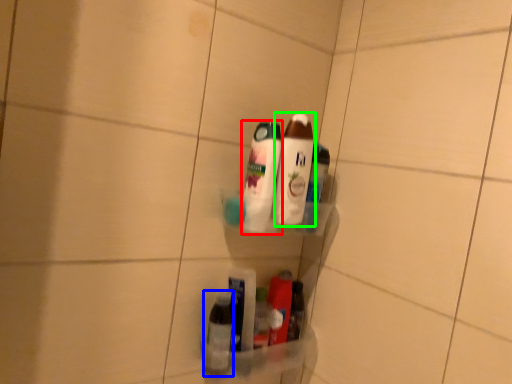
Question: Estimate the real-world distances between objects in this image. Which object is closer to bottle (highlighted by a red box), bottle (highlighted by a blue box) or bottle (highlighted by a green box)?

Choices:
 (A) bottle
 (B) bottle

Answer: (B)